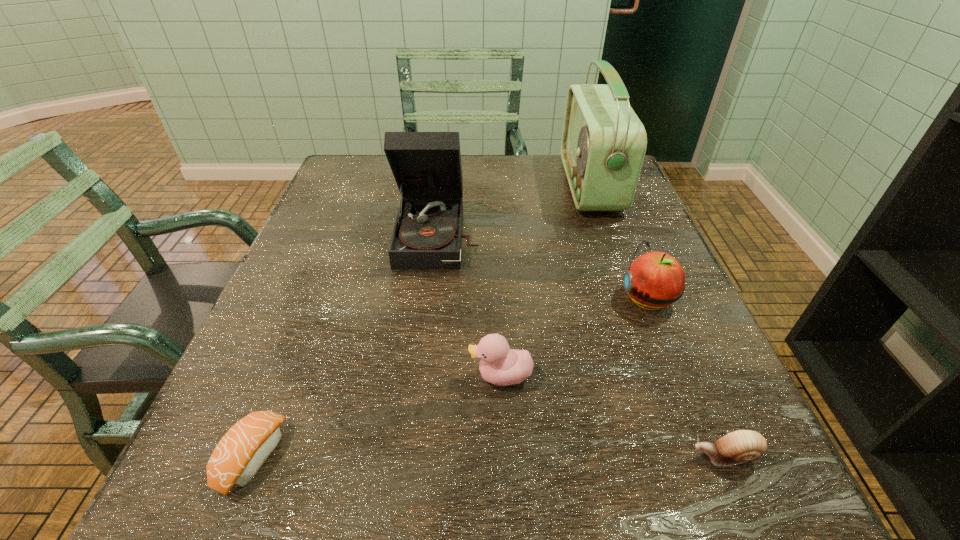
At what (x,y) coordinates should I click in order to perform the action: click on the tallest object. Please return your answer as a coordinate pair (x, y). This screenshot has width=960, height=540. Looking at the image, I should click on (603, 145).

This screenshot has height=540, width=960. What are the coordinates of `the fifth shortest object` in the screenshot? It's located at (427, 168).

Where is `apple`? Image resolution: width=960 pixels, height=540 pixels. apple is located at coordinates (655, 280).

The image size is (960, 540). In order to click on the fourth shortest object in this screenshot , I will do `click(655, 280)`.

You are a GUI agent. You are given a task and a screenshot of the screen. Output one action in this format:
    pyautogui.click(x=<x>, y=<y>)
    Task: Click on the duckling
    This screenshot has height=540, width=960.
    Given the screenshot: What is the action you would take?
    pyautogui.click(x=500, y=365)

Find the location of a particular element. the fourth tallest object is located at coordinates (500, 365).

Where is `escargot`? This screenshot has height=540, width=960. escargot is located at coordinates (739, 446).

Find the location of `the shortest object`. the shortest object is located at coordinates (242, 451).

At what (x,y) coordinates should I click in order to perform the action: click on sushi. Please return your answer as a coordinate pair (x, y). Looking at the image, I should click on (242, 451).

Where is `vacant area situated 0.170m on the front panel of the radio receiver`? vacant area situated 0.170m on the front panel of the radio receiver is located at coordinates (501, 185).